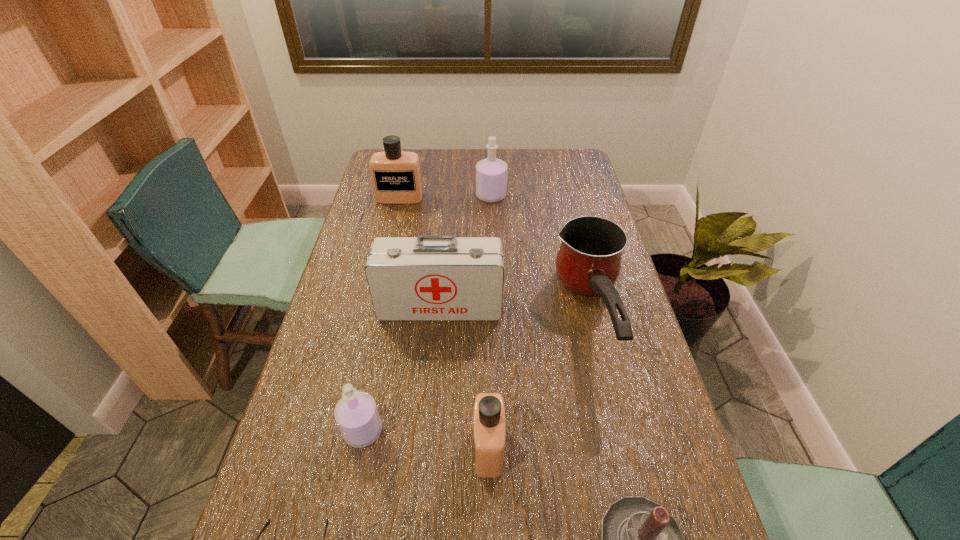
This screenshot has width=960, height=540. What are the coordinates of `perfume identified as the second closest to the saucepan` in the screenshot? It's located at (491, 173).

This screenshot has height=540, width=960. I want to click on the third closest perfume to the second shortest object, so click(x=491, y=173).

Find the location of a particular element. The image size is (960, 540). free space that satisfies the following two spatial constraints: 1. on the handle side of the saucepan; 2. on the front label of the smaller beige perfume is located at coordinates (623, 448).